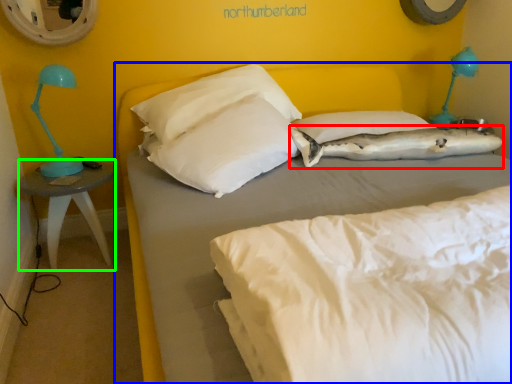
Question: Which object is the farthest from pillow (highlighted by a red box)? Choose among these: bed (highlighted by a blue box) or nightstand (highlighted by a green box).

Choices:
 (A) bed
 (B) nightstand

Answer: (B)